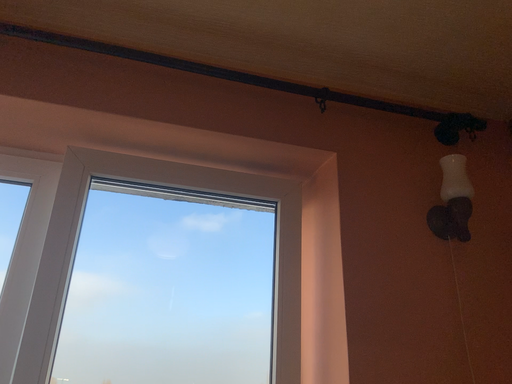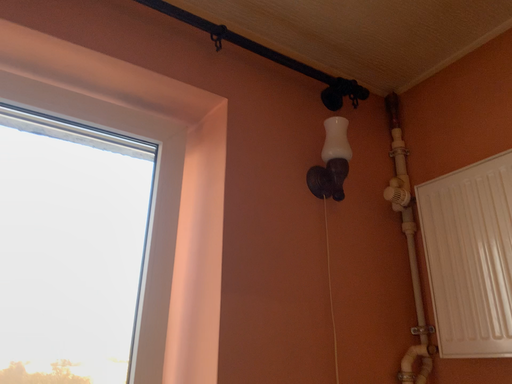
Question: Which way did the camera rotate in the video?

Choices:
 (A) rotated left
 (B) rotated right

Answer: (B)